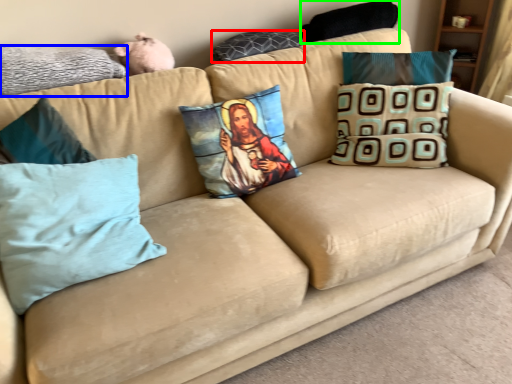
Question: Which object is the farthest from pillow (highlighted by a red box)? Choose among these: pillow (highlighted by a blue box) or pillow (highlighted by a green box).

Choices:
 (A) pillow
 (B) pillow

Answer: (A)